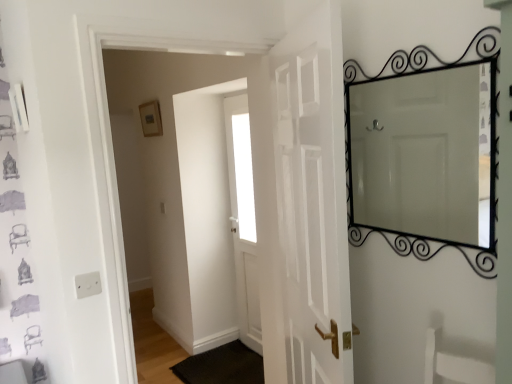
Question: Can you confirm if black rubber doormat at lower center is taller than white glossy door at center, positioned as the second door in back-to-front order?

Choices:
 (A) yes
 (B) no

Answer: (B)

Question: From a real-world perspective, is black rubber doormat at lower center on top of white glossy door at center, the first door in the front-to-back sequence?

Choices:
 (A) no
 (B) yes

Answer: (A)

Question: Does black rubber doormat at lower center have a greater width compared to white glossy door at center, positioned as the second door in back-to-front order?

Choices:
 (A) yes
 (B) no

Answer: (A)

Question: Does black rubber doormat at lower center lie in front of white glossy door at center, the first door in the front-to-back sequence?

Choices:
 (A) yes
 (B) no

Answer: (B)

Question: Is black rubber doormat at lower center at the right side of white glossy door at center, the first door in the front-to-back sequence?

Choices:
 (A) no
 (B) yes

Answer: (A)

Question: From their relative heights in the image, would you say black wrought iron mirror at upper right is taller or shorter than matte gold picture frame at upper center?

Choices:
 (A) short
 (B) tall

Answer: (B)

Question: Based on their sizes in the image, would you say black wrought iron mirror at upper right is bigger or smaller than matte gold picture frame at upper center?

Choices:
 (A) big
 (B) small

Answer: (A)

Question: From a real-world perspective, is black wrought iron mirror at upper right above or below matte gold picture frame at upper center?

Choices:
 (A) above
 (B) below

Answer: (B)

Question: Which is correct: black wrought iron mirror at upper right is inside matte gold picture frame at upper center, or outside of it?

Choices:
 (A) outside
 (B) inside

Answer: (A)

Question: From the image's perspective, relative to white glossy door at center, positioned as the second door in back-to-front order, is black wrought iron mirror at upper right above or below?

Choices:
 (A) above
 (B) below

Answer: (A)

Question: Do you think black wrought iron mirror at upper right is within white glossy door at center, the first door in the front-to-back sequence, or outside of it?

Choices:
 (A) inside
 (B) outside

Answer: (B)

Question: From their relative heights in the image, would you say black wrought iron mirror at upper right is taller or shorter than white glossy door at center, positioned as the second door in back-to-front order?

Choices:
 (A) short
 (B) tall

Answer: (A)

Question: From a real-world perspective, is black wrought iron mirror at upper right positioned above or below white glossy door at center, the first door in the front-to-back sequence?

Choices:
 (A) below
 (B) above

Answer: (B)

Question: From their relative heights in the image, would you say black rubber doormat at lower center is taller or shorter than black wrought iron mirror at upper right?

Choices:
 (A) short
 (B) tall

Answer: (A)

Question: Is black rubber doormat at lower center to the left or to the right of black wrought iron mirror at upper right in the image?

Choices:
 (A) left
 (B) right

Answer: (A)